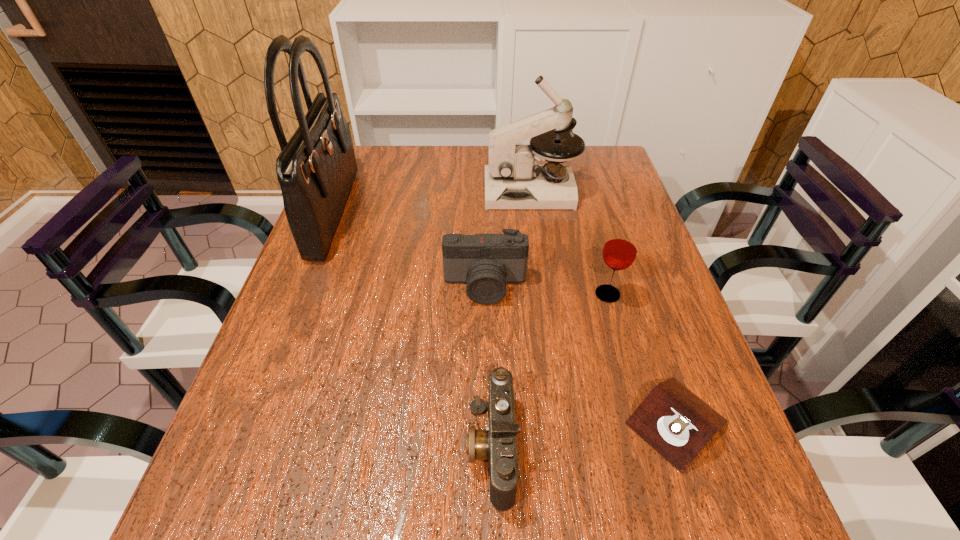
The width and height of the screenshot is (960, 540). What are the coordinates of `vacant space that satisfies the following two spatial constraints: 1. with an open clasp on the front of the leftmost object; 2. on the left side of the shortest object` in the screenshot? It's located at (253, 422).

The image size is (960, 540). I want to click on vacant position in the image that satisfies the following two spatial constraints: 1. with an open clasp on the front of the handbag; 2. on the right side of the fourth shortest object, so (303, 294).